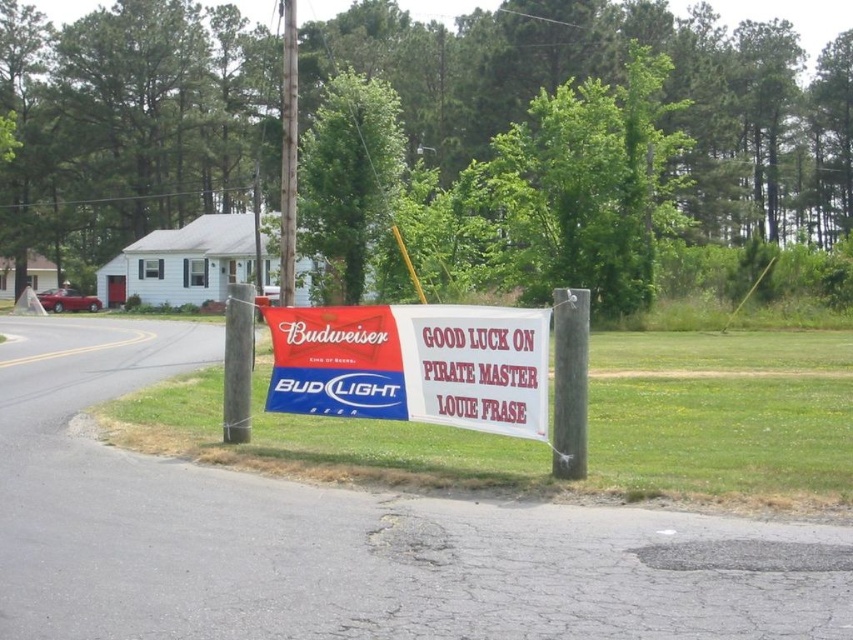
Question: Which of the following is the farthest from the observer?

Choices:
 (A) (291, 104)
 (B) (514, 403)
 (C) (579, 353)

Answer: (A)

Question: In this image, where is smooth gray pole at center located relative to metallic gray pole at center?

Choices:
 (A) above
 (B) below

Answer: (A)

Question: Is metallic pole at center smaller than metallic gray pole at center?

Choices:
 (A) yes
 (B) no

Answer: (B)

Question: Among these objects, which one is farthest from the camera?

Choices:
 (A) matte plastic banner at center
 (B) smooth gray pole at center

Answer: (A)

Question: Among these points, which one is farthest from the camera?

Choices:
 (A) (447, 378)
 (B) (560, 429)

Answer: (A)

Question: Is matte plastic banner at center further to camera compared to metallic gray pole at center?

Choices:
 (A) no
 (B) yes

Answer: (A)